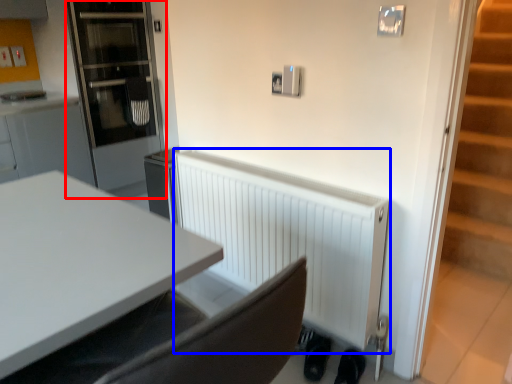
Question: Which of the following is the closest to the observer, glass door (highlighted by a red box) or radiator (highlighted by a blue box)?

Choices:
 (A) glass door
 (B) radiator

Answer: (B)